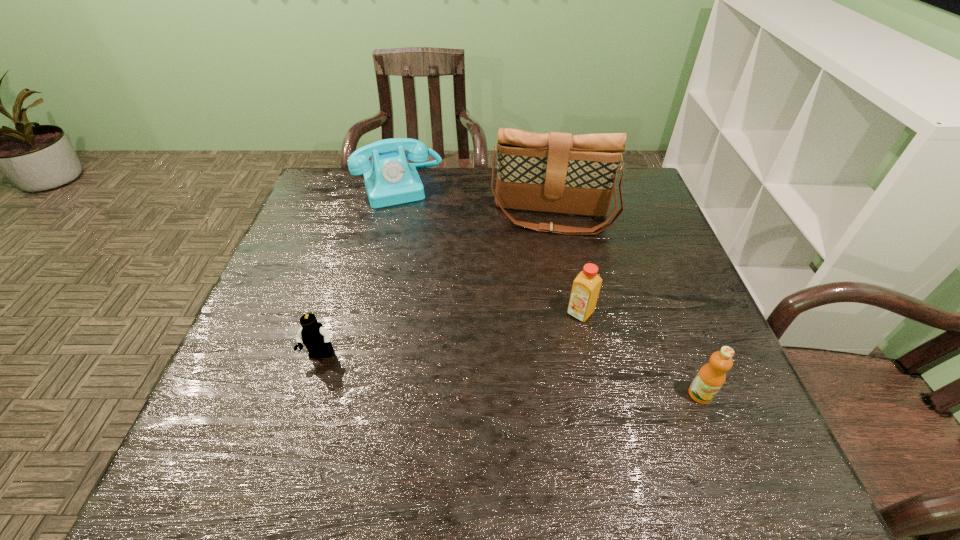
Locate an element on the screen. Image resolution: width=960 pixels, height=540 pixels. vacant space located on the front and back of the left orange juice is located at coordinates (547, 354).

Find the location of `free space located on the front and back of the left orange juice`. free space located on the front and back of the left orange juice is located at coordinates (553, 347).

At what (x,y) coordinates should I click in order to perform the action: click on vacant area situated 0.260m on the front-facing side of the tallest object. Please return your answer as a coordinate pair (x, y). Looking at the image, I should click on (541, 308).

Identify the location of free region located on the front-facing side of the tallest object. This screenshot has height=540, width=960. 540,328.

The width and height of the screenshot is (960, 540). Find the location of `free space located 0.300m on the front-facing side of the tallest object`. free space located 0.300m on the front-facing side of the tallest object is located at coordinates (540, 321).

The image size is (960, 540). What are the coordinates of `vacant space located on the dial of the telephone` in the screenshot? It's located at (424, 253).

The width and height of the screenshot is (960, 540). I want to click on vacant space located on the dial of the telephone, so click(420, 239).

Identify the location of blank space located on the dial of the telephone. The image size is (960, 540). (440, 295).

Find the location of a particular element. This screenshot has width=960, height=540. shoulder bag present at the far edge is located at coordinates (555, 172).

Identify the location of telephone that is at the far edge. Image resolution: width=960 pixels, height=540 pixels. (389, 180).